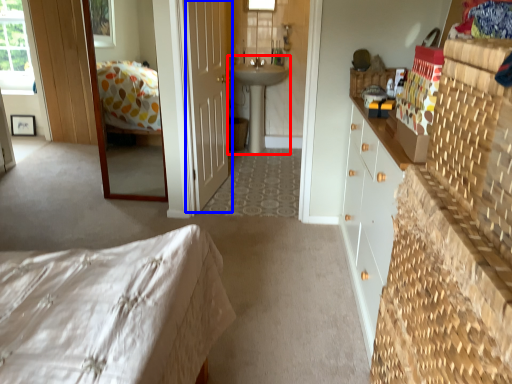
Question: Among these objects, which one is nearest to the camera, sink (highlighted by a red box) or door (highlighted by a blue box)?

Choices:
 (A) sink
 (B) door

Answer: (B)